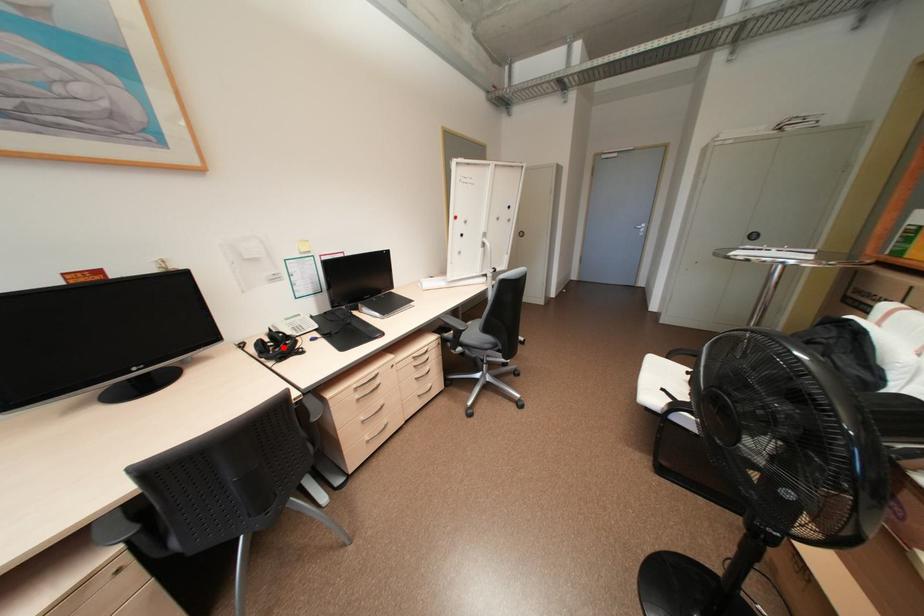
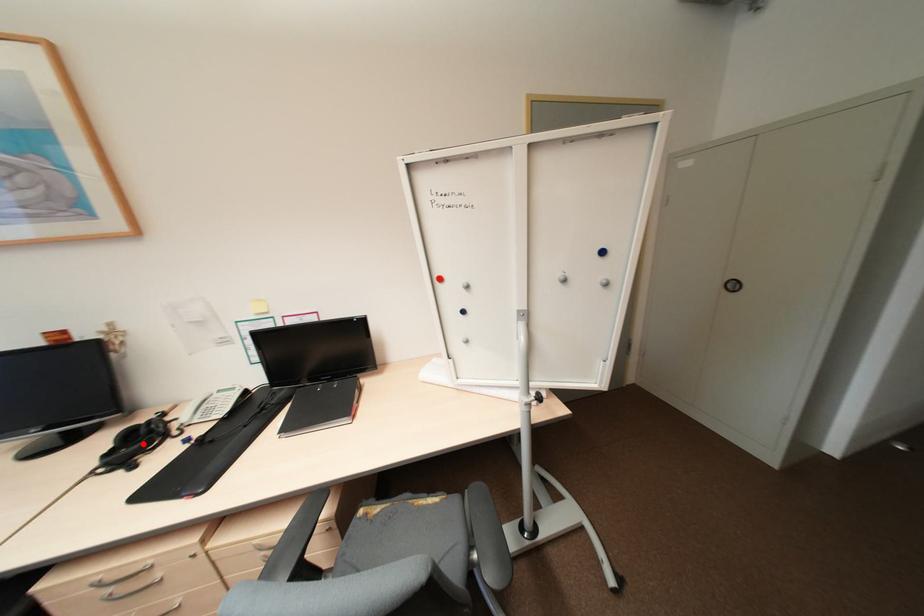
I am providing you with two images of the same scene from different viewpoints. A red point is marked on the first image and another point is marked on the second image. Is the red point in image1 aligned with the point shown in image2?

Yes